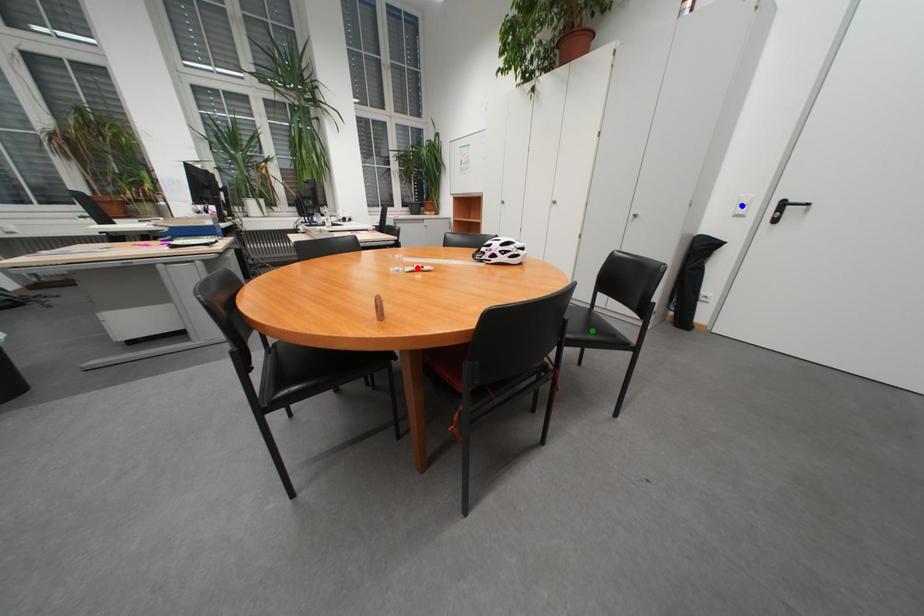
Order these from farthest to nearest:
A) blue point
B) red point
C) green point

blue point → red point → green point